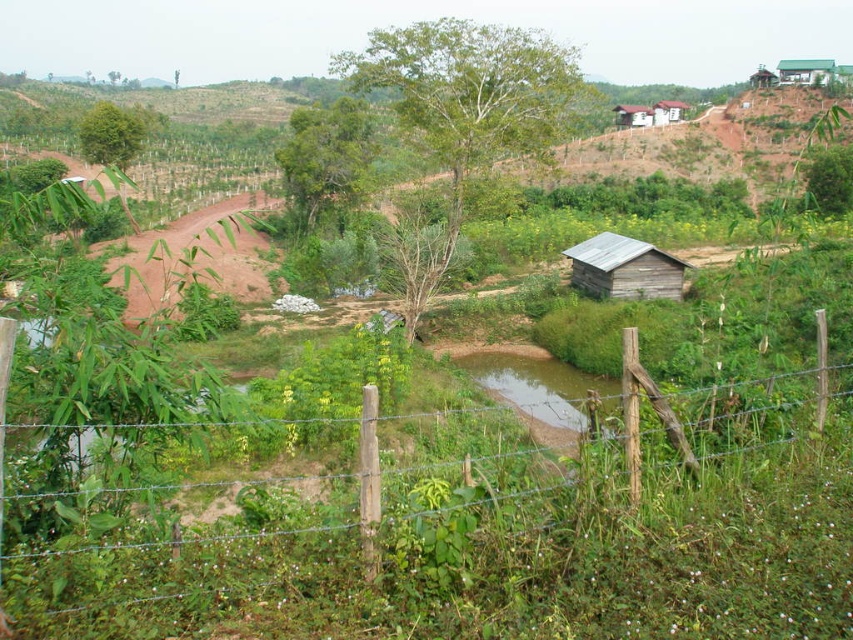
You are a hiker trying to cross the wooden post fence at lower center to reach the wooden shack at upper right. Which direction should you head relative to the fence to get to the shack?

The wooden post fence at lower center is to the left of the wooden shack at upper right, so you should head to the right relative to the fence to reach the shack.